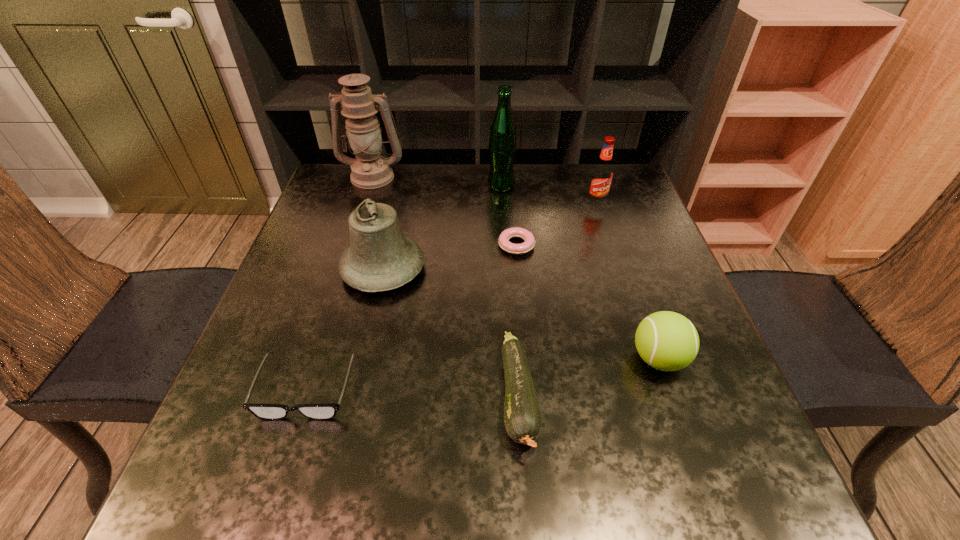
Identify the location of vacant region located on the back of the third farthest object. Image resolution: width=960 pixels, height=540 pixels. pyautogui.click(x=587, y=173).

At what (x,y) coordinates should I click in order to perform the action: click on blank area located on the back of the bell. Please return your answer as a coordinate pair (x, y). Image resolution: width=960 pixels, height=540 pixels. Looking at the image, I should click on (400, 197).

At what (x,y) coordinates should I click in order to perform the action: click on free space located on the back of the fifth tallest object. Please return your answer as a coordinate pair (x, y). The image size is (960, 540). Looking at the image, I should click on (638, 302).

You are a GUI agent. You are given a task and a screenshot of the screen. Output one action in this format:
    pyautogui.click(x=<x>, y=<y>)
    Task: Click on the vacant region located 0.060m at the blossom end of the sixth tallest object
    The height and width of the screenshot is (540, 960).
    Given the screenshot: What is the action you would take?
    pyautogui.click(x=527, y=503)

Where is `vacant space located 0.100m on the front-facing side of the seventh tallest object`? This screenshot has width=960, height=540. vacant space located 0.100m on the front-facing side of the seventh tallest object is located at coordinates (276, 483).

Where is `vacant space situated on the back of the doughnut`? vacant space situated on the back of the doughnut is located at coordinates (510, 173).

You are a GUI agent. You are given a task and a screenshot of the screen. Output one action in this format:
    pyautogui.click(x=<x>, y=<y>)
    Task: Click on the oil lamp located at the far edge
    
    Given the screenshot: What is the action you would take?
    pyautogui.click(x=370, y=170)

Where is `beer bottle present at the far edge`? The image size is (960, 540). beer bottle present at the far edge is located at coordinates (502, 147).

Where is `root beer positioned at the far edge`? Image resolution: width=960 pixels, height=540 pixels. root beer positioned at the far edge is located at coordinates (602, 173).

Locate an element on the screen. The height and width of the screenshot is (540, 960). object at the near edge is located at coordinates pos(522,418).